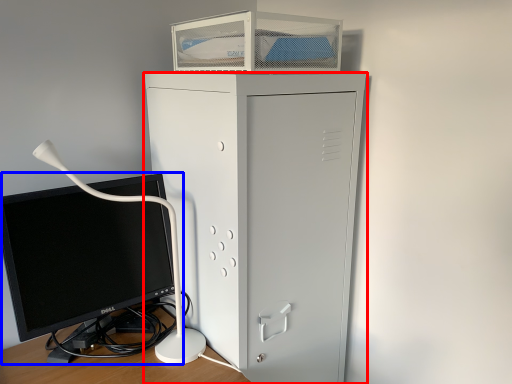
Question: Among these objects, which one is nearest to the camera, furniture (highlighted by a red box) or computer monitor (highlighted by a blue box)?

Choices:
 (A) furniture
 (B) computer monitor

Answer: (B)